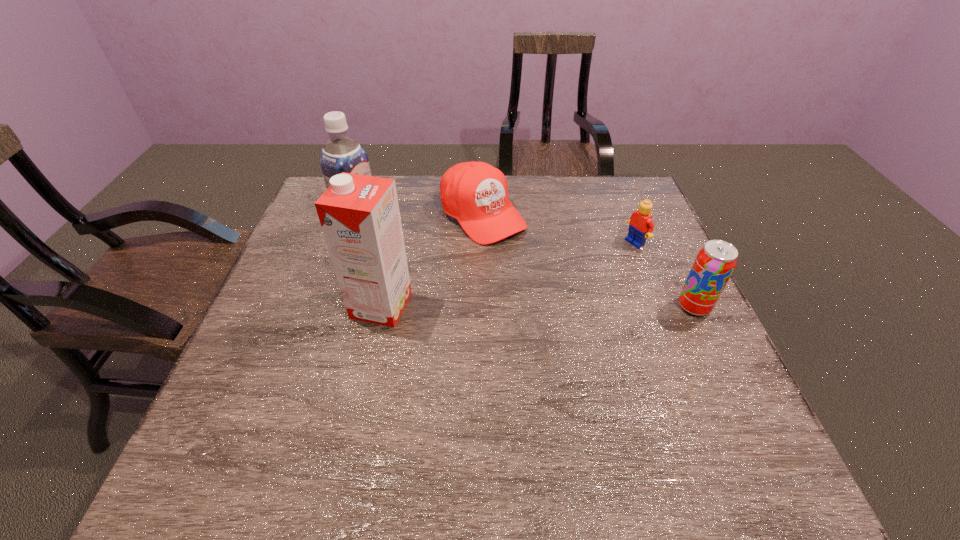
What are the coordinates of `carton` in the screenshot? It's located at (359, 215).

This screenshot has width=960, height=540. Find the location of `the rightmost object`. the rightmost object is located at coordinates (715, 262).

Find the location of a particular element. The height and width of the screenshot is (540, 960). soda can is located at coordinates point(715,262).

At what (x,y) coordinates should I click in order to perform the action: click on soya milk. Please return your answer as a coordinate pair (x, y). This screenshot has height=540, width=960. Looking at the image, I should click on (340, 154).

You are a GUI agent. You are given a task and a screenshot of the screen. Output one action in this format:
    pyautogui.click(x=<x>, y=<y>)
    Task: Click on the baseball cap
    The image size is (960, 540).
    Given the screenshot: What is the action you would take?
    pyautogui.click(x=475, y=193)

Find the location of `Lego`. Lego is located at coordinates (641, 226).

You are a GUI agent. You are given a task and a screenshot of the screen. Output one action in this format:
    pyautogui.click(x=<x>, y=<y>)
    Task: Click on the vacant space located 0.090m on the left of the carton
    
    Given the screenshot: What is the action you would take?
    pyautogui.click(x=315, y=306)

Where is `free space located on the back of the rightmost object`? This screenshot has width=960, height=540. free space located on the back of the rightmost object is located at coordinates (660, 232).

Identify the location of vacant space located 0.340m on the label of the soya milk. Image resolution: width=960 pixels, height=540 pixels. (477, 283).

At what (x,y) coordinates should I click in order to perform the action: click on free space located 0.290m on the label of the soya milk. Please return your answer as a coordinate pair (x, y). The image size is (960, 540). Looking at the image, I should click on (461, 275).